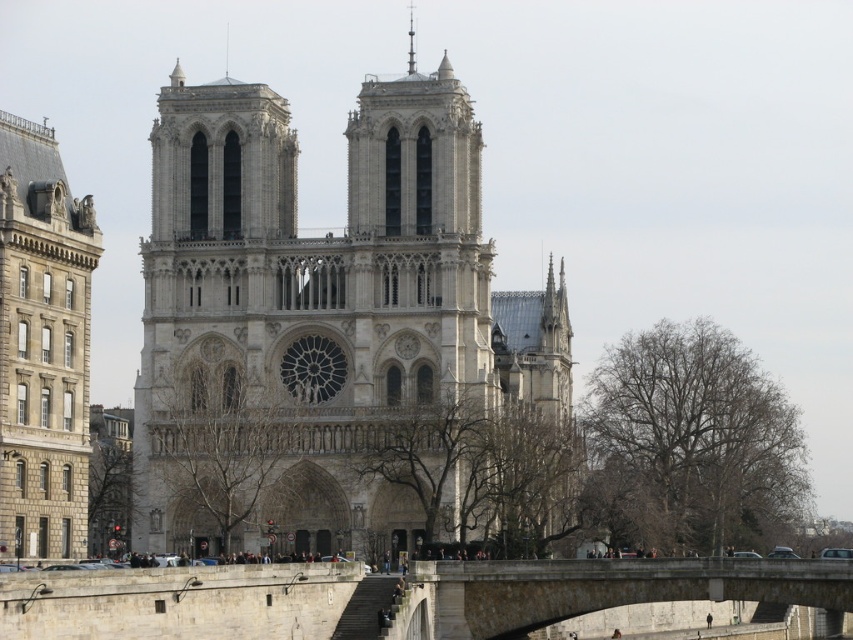
Can you confirm if gray stone tower at left is smaller than smooth silver spire at upper center?

Actually, gray stone tower at left might be larger than smooth silver spire at upper center.

Which is above, gray stone tower at left or smooth silver spire at upper center?

smooth silver spire at upper center is above.

The image size is (853, 640). What are the coordinates of `gray stone tower at left` in the screenshot? It's located at (42, 346).

Does gray stone cathedral at center appear over smooth silver spire at upper center?

No, gray stone cathedral at center is not above smooth silver spire at upper center.

Who is more distant from viewer, [259,532] or [413,29]?

Positioned behind is point [413,29].

Find the location of a particular element. The image size is (853, 640). gray stone cathedral at center is located at coordinates (329, 330).

Who is positioned more to the left, gray stone tower at left or gray stone bridge at lower center?

gray stone tower at left

Who is more distant from viewer, [49,500] or [671,579]?

The point [671,579] is more distant.

Locate an element on the screen. This screenshot has height=640, width=853. gray stone tower at left is located at coordinates (42, 346).